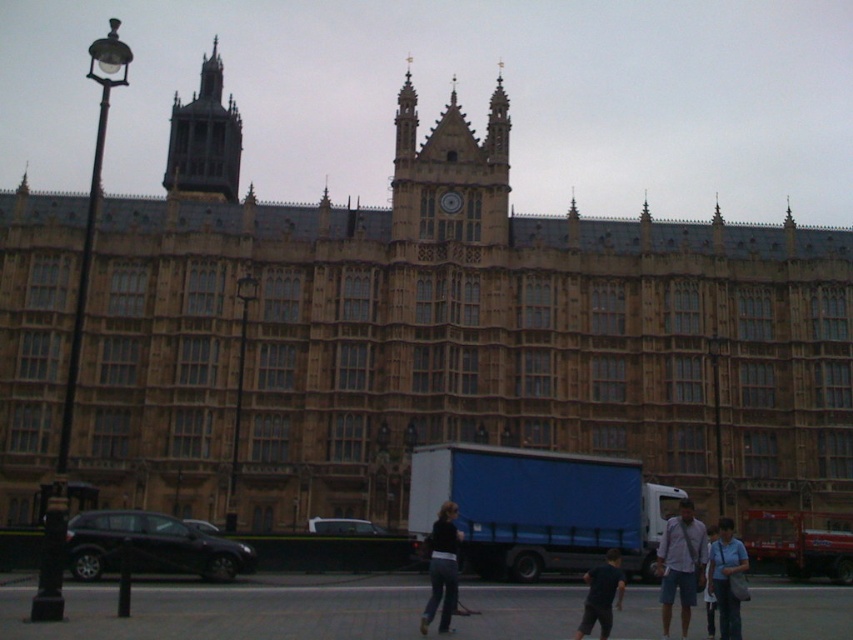
In the scene shown: Who is more forward, (444, 547) or (733, 545)?

Point (444, 547)

Image resolution: width=853 pixels, height=640 pixels. Find the location of `dark blue jeans at center`. dark blue jeans at center is located at coordinates (442, 568).

Can you confirm if light blue shirt at center is shorter than gold metallic clock at center?

In fact, light blue shirt at center may be taller than gold metallic clock at center.

The width and height of the screenshot is (853, 640). Describe the element at coordinates (680, 564) in the screenshot. I see `light blue shirt at center` at that location.

This screenshot has height=640, width=853. I want to click on light blue shirt at center, so click(680, 564).

The height and width of the screenshot is (640, 853). What do you see at coordinates (680, 564) in the screenshot? I see `light blue shirt at center` at bounding box center [680, 564].

Measure the distance between light blue shirt at center and camera.

light blue shirt at center is 66.74 meters away from camera.

Measure the distance between light blue shirt at center and camera.

light blue shirt at center is 218.97 feet from camera.

I want to click on light blue shirt at center, so click(680, 564).